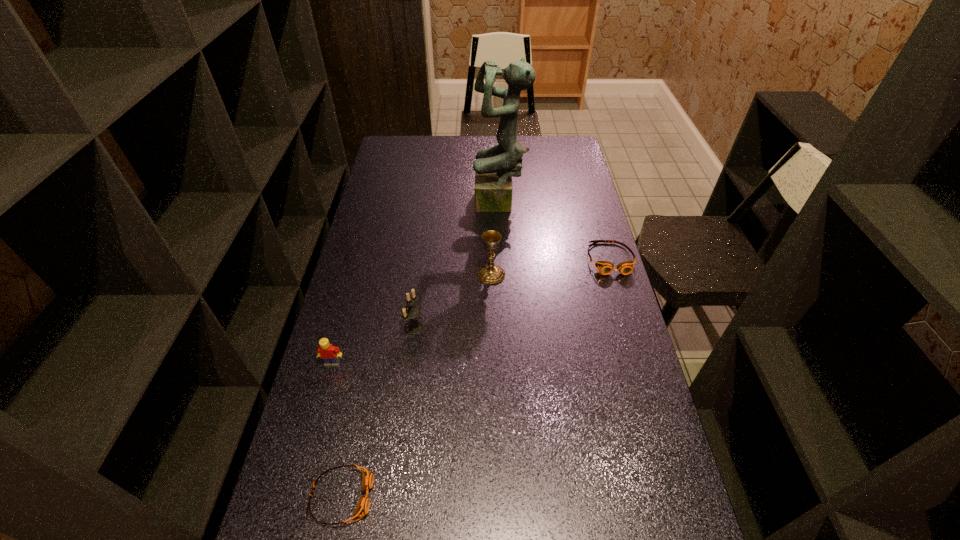
Locate an element on the screen. The image size is (960, 540). vacant space that's between the second shortest object and the Lego is located at coordinates (471, 311).

Locate an element on the screen. unoccupied area between the Lego and the tallest object is located at coordinates (416, 284).

Identify the location of empty space between the chalice and the shortest object. The image size is (960, 540). (416, 386).

You are a GUI agent. You are given a task and a screenshot of the screen. Output one action in this format:
    pyautogui.click(x=<x>, y=<y>)
    Task: Click on the vacant area that lies between the candle holder and the taller goggles
    The height and width of the screenshot is (540, 960).
    Given the screenshot: What is the action you would take?
    pyautogui.click(x=512, y=293)

Identify the location of free spot between the sculpture and the farther goggles. This screenshot has height=540, width=960. (555, 232).

The height and width of the screenshot is (540, 960). In order to click on free spot between the second shortest object and the third shortest object in this screenshot , I will do `click(471, 311)`.

Identify which object is located as the third nearest to the right goggles. Please provide its 2D coordinates. Your answer should be formatted as a tuple, i.e. [(x, y)], where the tuple contains the x and y coordinates of a point satisfying the conditions above.

[(410, 310)]

Point out which object is positioned as the fourth nearest to the chalice. Please provide its 2D coordinates. Your answer should be formatted as a tuple, i.e. [(x, y)], where the tuple contains the x and y coordinates of a point satisfying the conditions above.

[(330, 354)]

Locate an element on the screen. This screenshot has height=540, width=960. free point that satisfies the following two spatial constraints: 1. on the face of the sculpture; 2. on the front-facing side of the third shortest object is located at coordinates (507, 363).